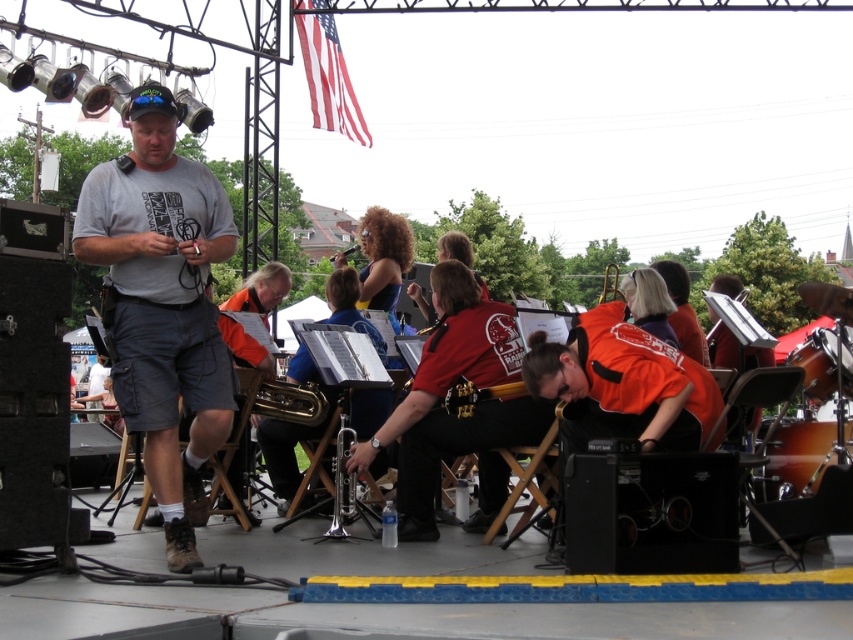
Question: Does wooden drum at right have a greater width compared to gold metallic guitar at center?

Choices:
 (A) no
 (B) yes

Answer: (A)

Question: Estimate the real-world distances between objects in this image. Which object is closer to the wooden drum at right?

Choices:
 (A) silver metallic trumpet at center
 (B) brass/yellowish metal trumpet at center
 (C) shiny brown drum at lower right
 (D) gold metallic guitar at center

Answer: (C)

Question: Estimate the real-world distances between objects in this image. Which object is closer to the silver metallic trumpet at center?

Choices:
 (A) shiny brown drum at lower right
 (B) gray cotton t-shirt at left

Answer: (B)

Question: Observing the image, what is the correct spatial positioning of shiny brown drum at lower right in reference to gold metallic guitar at center?

Choices:
 (A) right
 (B) left

Answer: (A)

Question: Does silver metallic trumpet at center lie in front of gold metallic guitar at center?

Choices:
 (A) yes
 (B) no

Answer: (A)

Question: Based on their relative distances, which object is farther from the wooden drum at right?

Choices:
 (A) silver metallic trumpet at center
 (B) brass/yellowish metal trumpet at center
 (C) gray cotton t-shirt at left
 (D) shiny brown drum at lower right

Answer: (C)